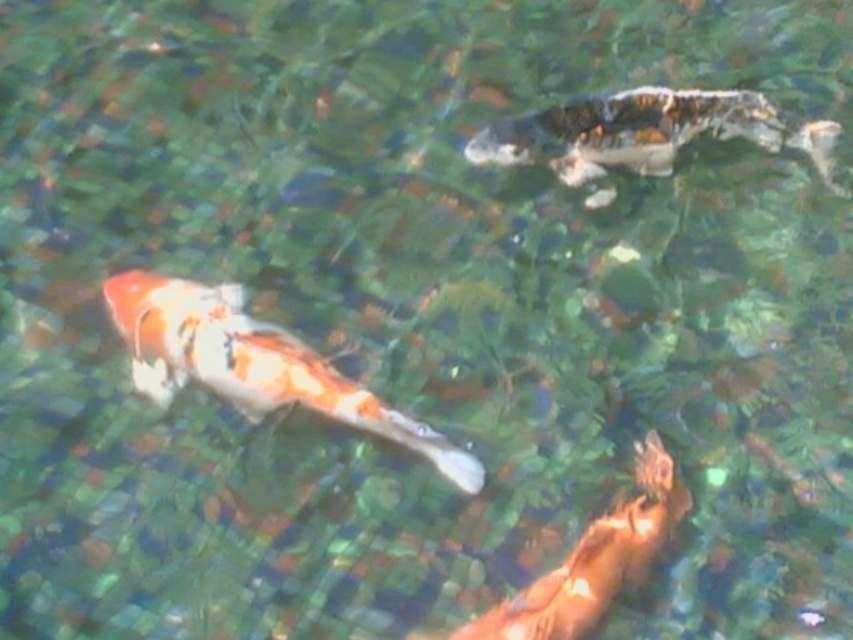
Can you confirm if speckled white fish at upper right is shorter than orange and white scaled fish at bottom right?

Yes.

Is speckled white fish at upper right to the left of orange and white scaled fish at bottom right from the viewer's perspective?

No, speckled white fish at upper right is not to the left of orange and white scaled fish at bottom right.

Is point (553, 132) less distant than point (590, 547)?

No, (553, 132) is behind (590, 547).

Locate an element on the screen. This screenshot has width=853, height=640. speckled white fish at upper right is located at coordinates pos(645,132).

Does point (473, 484) come closer to viewer compared to point (505, 600)?

No, it is behind (505, 600).

You are a GUI agent. You are given a task and a screenshot of the screen. Output one action in this format:
    pyautogui.click(x=<x>, y=<y>)
    Task: Click on the orange and white scaled fish at center
    The height and width of the screenshot is (640, 853).
    Given the screenshot: What is the action you would take?
    pyautogui.click(x=252, y=364)

This screenshot has height=640, width=853. In order to click on orange and white scaled fish at center in this screenshot , I will do `click(252, 364)`.

Can you confirm if orange and white scaled fish at center is smaller than speckled white fish at upper right?

No.

Identify the location of orange and white scaled fish at center. Image resolution: width=853 pixels, height=640 pixels. (252, 364).

Where is `orange and white scaled fish at center`? orange and white scaled fish at center is located at coordinates (252, 364).